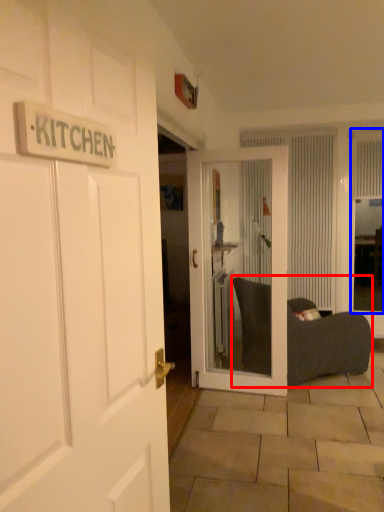
Question: Which object is closer to the camera taking this photo, bean bag chair (highlighted by a red box) or window screen (highlighted by a blue box)?

Choices:
 (A) bean bag chair
 (B) window screen

Answer: (A)